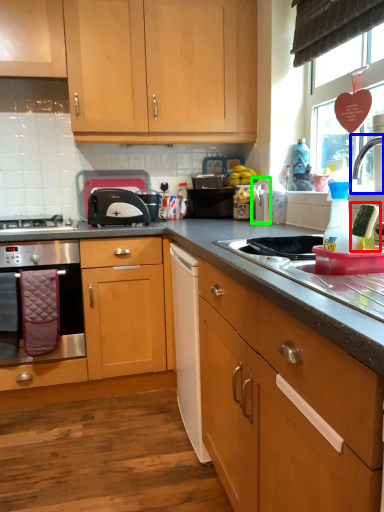
Question: Which is farther away from appliance (highlighted by a red box)? tap (highlighted by a blue box) or appliance (highlighted by a green box)?

Choices:
 (A) tap
 (B) appliance

Answer: (B)